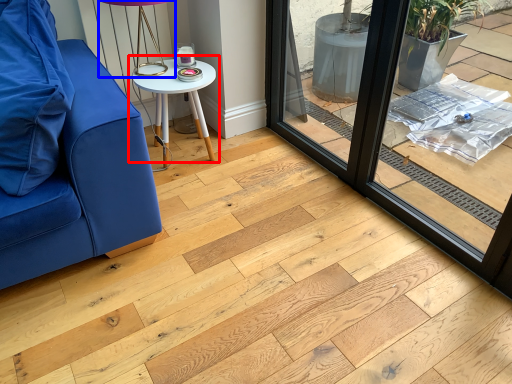
Question: Which object is closer to the camera taking this photo, table (highlighted by a red box) or table lamp (highlighted by a blue box)?

Choices:
 (A) table
 (B) table lamp

Answer: (B)